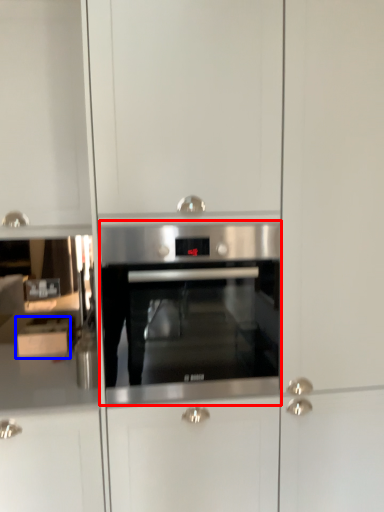
Question: Which object is further to the camera taking this photo, oven (highlighted by a red box) or cabinetry (highlighted by a blue box)?

Choices:
 (A) oven
 (B) cabinetry

Answer: (B)